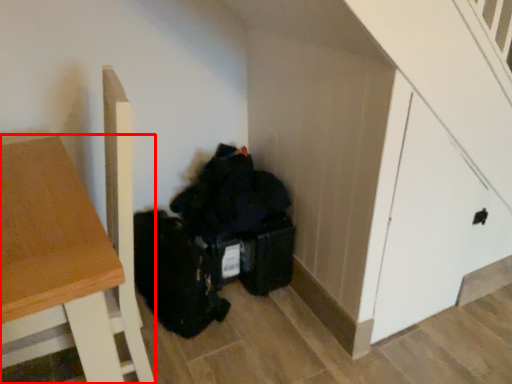
Question: Where is table (annotated by the red box) located in relation to door in the image?

Choices:
 (A) left
 (B) right

Answer: (A)